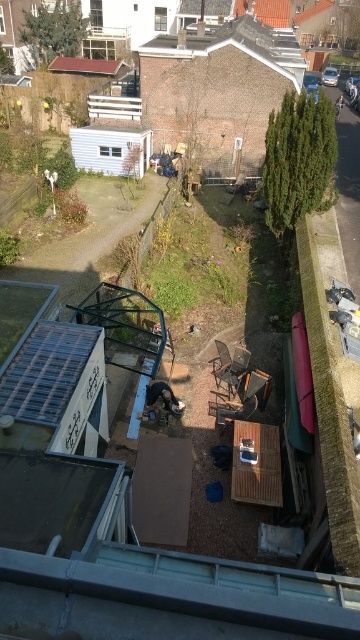
Where is `red tile roof at upper center`? red tile roof at upper center is located at coordinates (86, 65).

Who is taller, red tile roof at upper center or wooden chair at center?

red tile roof at upper center

Describe the element at coordinates (86, 65) in the screenshot. I see `red tile roof at upper center` at that location.

This screenshot has width=360, height=640. What are the coordinates of `red tile roof at upper center` in the screenshot? It's located at (86, 65).

Can you confirm if brown shingles at upper center is positioned above wooden chair at center?

Indeed, brown shingles at upper center is positioned over wooden chair at center.

Can you confirm if brown shingles at upper center is wider than wooden chair at center?

Yes, brown shingles at upper center is wider than wooden chair at center.

The height and width of the screenshot is (640, 360). Identify the location of brown shingles at upper center. (236, 45).

Does brown shingles at upper center have a greater height compared to red tile roof at upper center?

Correct, brown shingles at upper center is much taller as red tile roof at upper center.

This screenshot has height=640, width=360. In order to click on brown shingles at upper center in this screenshot , I will do `click(236, 45)`.

Find the location of a particular element. Image resolution: width=360 pixels, height=640 pixels. brown shingles at upper center is located at coordinates (236, 45).